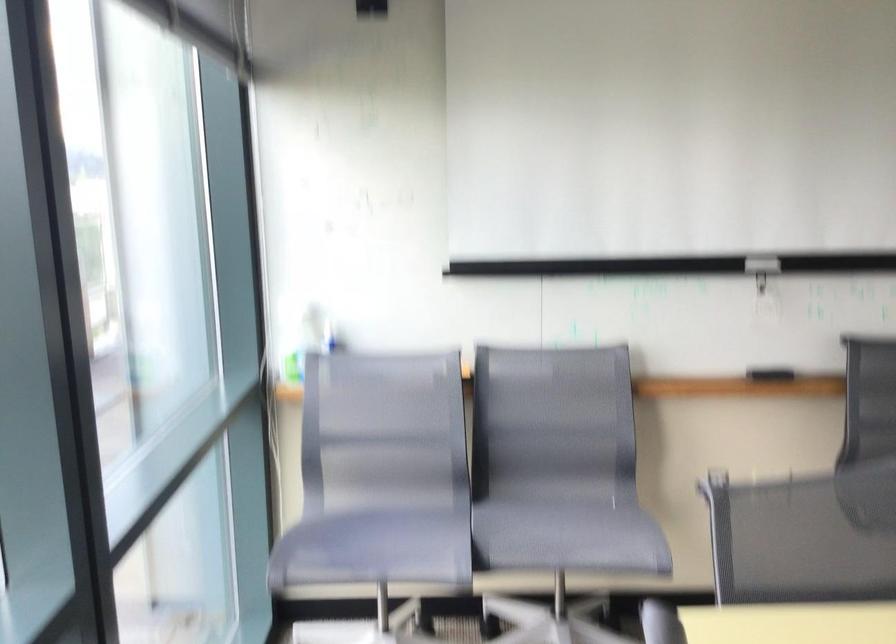
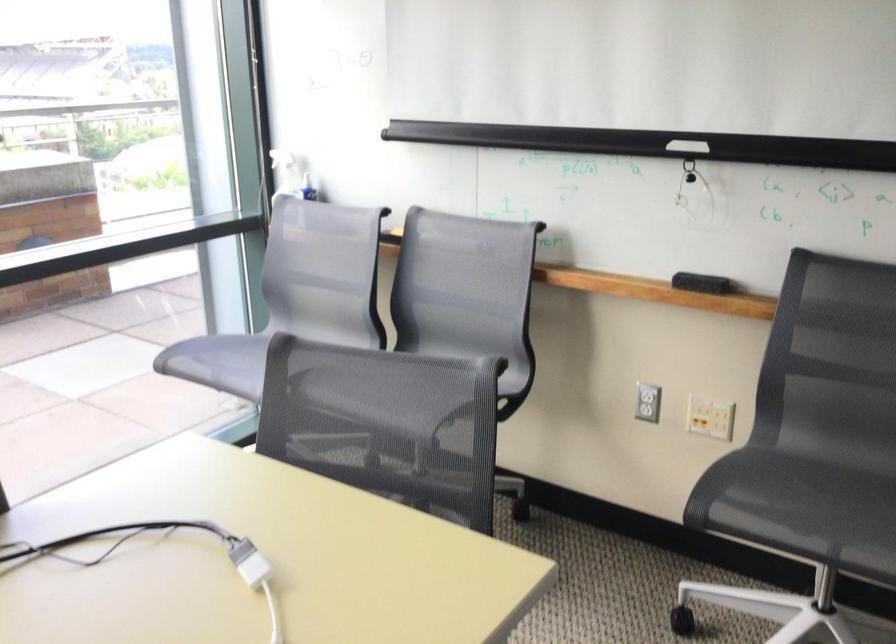
Find the pixel in the second image that matches the point at 780,377 in the first image.

(701, 283)